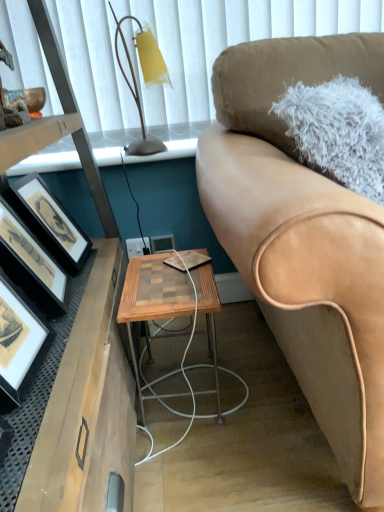
The height and width of the screenshot is (512, 384). Describe the element at coordinates (153, 298) in the screenshot. I see `woodenmaterial/texturetable at center` at that location.

Image resolution: width=384 pixels, height=512 pixels. Identify the location of matte black picture frame at left, the 2th picture frame from the back. (49, 221).

The image size is (384, 512). Find the location of `white fabric window screen at upper center`. white fabric window screen at upper center is located at coordinates (221, 50).

The image size is (384, 512). Find the location of `woodenmaterial/texturetable at center`. woodenmaterial/texturetable at center is located at coordinates (153, 298).

Does matte black picture frame at left, the 3th picture frame when ordered from back to front, have a greater height compared to wooden desk at left?

Incorrect, the height of matte black picture frame at left, the 3th picture frame when ordered from back to front, is not larger of that of wooden desk at left.

How many degrees apart are the facing directions of matte black picture frame at left, the second picture frame positioned from the left, and wooden desk at left?

7.05 degrees.

Between point (1, 232) and point (78, 117), which one is positioned behind?

Positioned behind is point (78, 117).

Is matte black picture frame at left, positioned as the second picture frame in right-to-left order, bigger or smaller than wooden desk at left?

In the image, matte black picture frame at left, positioned as the second picture frame in right-to-left order, appears to be smaller than wooden desk at left.

Can you confirm if tan leather couch at right is positioned to the right of matte black picture frame at left, positioned as the second picture frame in right-to-left order?

Indeed, tan leather couch at right is positioned on the right side of matte black picture frame at left, positioned as the second picture frame in right-to-left order.

From a real-world perspective, which is physically above, tan leather couch at right or matte black picture frame at left, positioned as the second picture frame in right-to-left order?

In real-world perspective, tan leather couch at right is above.

Considering the sizes of objects tan leather couch at right and matte black picture frame at left, the second picture frame positioned from the left, in the image provided, who is wider, tan leather couch at right or matte black picture frame at left, the second picture frame positioned from the left,?

tan leather couch at right.

Is matte black picture frame at left, the 3th picture frame when ordered from back to front, surrounded by tan leather couch at right?

That's incorrect, matte black picture frame at left, the 3th picture frame when ordered from back to front, is not inside tan leather couch at right.

Is wooden desk at left located outside wooden picture frame at center, positioned as the third picture frame in left-to-right order?

Yes, wooden desk at left is outside of wooden picture frame at center, positioned as the third picture frame in left-to-right order.

Which is in front, wooden desk at left or wooden picture frame at center, acting as the 3th picture frame starting from the front?

wooden desk at left is in front.

Which is closer to the camera, (x=38, y=17) or (x=168, y=242)?

Point (x=38, y=17).

Which of these two, wooden desk at left or wooden picture frame at center, positioned as the third picture frame in left-to-right order, is smaller?

wooden picture frame at center, positioned as the third picture frame in left-to-right order.

Does matte black picture frame at left, which is the third picture frame in right-to-left order, lie behind tan leather couch at right?

Yes, it is.

From the picture: Between matte black picture frame at left, which is the third picture frame in right-to-left order, and tan leather couch at right, which one appears on the right side from the viewer's perspective?

tan leather couch at right is more to the right.

Could you tell me if matte black picture frame at left, which is the third picture frame in right-to-left order, is facing tan leather couch at right?

Yes, matte black picture frame at left, which is the third picture frame in right-to-left order, is oriented towards tan leather couch at right.

Is tan leather couch at right completely or partially inside matte black picture frame at left, which is the third picture frame in right-to-left order?

No, tan leather couch at right is not surrounded by matte black picture frame at left, which is the third picture frame in right-to-left order.

Which object is further away from the camera taking this photo, matte yellow glass at upper left or matte black picture frame at left, placed as the first picture frame when sorted from front to back?

matte yellow glass at upper left is further away from the camera.

Are matte yellow glass at upper left and matte black picture frame at left, positioned as the second picture frame in right-to-left order, far apart?

Actually, matte yellow glass at upper left and matte black picture frame at left, positioned as the second picture frame in right-to-left order, are a little close together.

Would you say matte yellow glass at upper left is inside or outside matte black picture frame at left, positioned as the second picture frame in right-to-left order?

matte yellow glass at upper left exists outside the volume of matte black picture frame at left, positioned as the second picture frame in right-to-left order.

Considering the relative sizes of matte yellow glass at upper left and matte black picture frame at left, positioned as the second picture frame in right-to-left order, in the image provided, is matte yellow glass at upper left shorter than matte black picture frame at left, positioned as the second picture frame in right-to-left order,?

In fact, matte yellow glass at upper left may be taller than matte black picture frame at left, positioned as the second picture frame in right-to-left order.

Between matte yellow glass at upper left and white fabric window screen at upper center, which one appears on the right side from the viewer's perspective?

From the viewer's perspective, white fabric window screen at upper center appears more on the right side.

From a real-world perspective, relative to white fabric window screen at upper center, is matte yellow glass at upper left vertically above or below?

In terms of real-world spatial position, matte yellow glass at upper left is below white fabric window screen at upper center.

Which of these two, matte yellow glass at upper left or white fabric window screen at upper center, stands shorter?

matte yellow glass at upper left is shorter.

Which is closer, [111,11] or [108,22]?

Point [111,11]

Which is behind, point (7, 214) or point (63, 229)?

Point (63, 229)

Considering the sizes of objects matte black picture frame at left, the 3th picture frame when ordered from back to front, and matte black picture frame at left, the 2th picture frame from the back, in the image provided, who is thinner, matte black picture frame at left, the 3th picture frame when ordered from back to front, or matte black picture frame at left, the 2th picture frame from the back,?

matte black picture frame at left, the 3th picture frame when ordered from back to front, is thinner.

In the scene shown: Can you confirm if matte black picture frame at left, placed as the first picture frame when sorted from front to back, is taller than matte black picture frame at left, which ranks as the 2th picture frame in front-to-back order?

Incorrect, the height of matte black picture frame at left, placed as the first picture frame when sorted from front to back, is not larger of that of matte black picture frame at left, which ranks as the 2th picture frame in front-to-back order.

Is matte black picture frame at left, which ranks as the 2th picture frame in front-to-back order, inside matte black picture frame at left, placed as the first picture frame when sorted from front to back?

No, matte black picture frame at left, which ranks as the 2th picture frame in front-to-back order, is not a part of matte black picture frame at left, placed as the first picture frame when sorted from front to back.

You are a GUI agent. You are given a task and a screenshot of the screen. Output one action in this format:
    pyautogui.click(x=<x>, y=<y>)
    Task: Click on the picture frame that is the 1st one below the wooden desk at left (from a real-world perspective)
    The image size is (384, 512).
    Given the screenshot: What is the action you would take?
    pyautogui.click(x=31, y=264)

The width and height of the screenshot is (384, 512). In order to click on the 2nd picture frame to the left of the tan leather couch at right, counting from the anchor's position in this screenshot , I will do click(x=31, y=264).

Considering their positions, is white fabric window screen at upper center positioned further to tan leather couch at right than matte yellow glass at upper left?

matte yellow glass at upper left is positioned further to the anchor tan leather couch at right.

Which object lies nearer to the anchor point matte black picture frame at left, the 2th picture frame from the back, wooden picture frame at center, which appears as the 1th picture frame when viewed from the right, or wooden desk at left?

wooden desk at left.

Looking at the image, which one is located closer to woodenmaterial/texturetable at center, matte black picture frame at left, placed as the first picture frame when sorted from front to back, or matte yellow glass at upper left?

The object closer to woodenmaterial/texturetable at center is matte black picture frame at left, placed as the first picture frame when sorted from front to back.

From the image, which object appears to be nearer to matte black picture frame at left, the second picture frame positioned from the left, matte yellow glass at upper left or white fabric window screen at upper center?

Among the two, white fabric window screen at upper center is located nearer to matte black picture frame at left, the second picture frame positioned from the left.

Which object lies further to the anchor point matte black picture frame at left, which ranks as the 2th picture frame in front-to-back order, tan leather couch at right or wooden picture frame at center, positioned as the third picture frame in left-to-right order?

tan leather couch at right.

From the image, which object appears to be nearer to matte yellow glass at upper left, tan leather couch at right or white fabric window screen at upper center?

white fabric window screen at upper center lies closer to matte yellow glass at upper left than the other object.

Based on their spatial positions, is matte yellow glass at upper left or wooden desk at left closer to woodenmaterial/texturetable at center?

wooden desk at left.

Estimate the real-world distances between objects in this image. Which object is closer to matte yellow glass at upper left, woodenmaterial/texturetable at center or white fabric window screen at upper center?

white fabric window screen at upper center is closer to matte yellow glass at upper left.

Identify the location of table lamp between white fabric window screen at upper center and woodenmaterial/texturetable at center in the up-down direction. (144, 79).

The width and height of the screenshot is (384, 512). In order to click on table lamp between tan leather couch at right and white fabric window screen at upper center from front to back in this screenshot , I will do `click(144, 79)`.

The image size is (384, 512). Find the location of `desk between matte black picture frame at left, positioned as the second picture frame in right-to-left order, and tan leather couch at right`. desk between matte black picture frame at left, positioned as the second picture frame in right-to-left order, and tan leather couch at right is located at coordinates 86,350.

At what (x,y) coordinates should I click in order to perform the action: click on table lamp between white fabric window screen at upper center and matte black picture frame at left, placed as the first picture frame when sorted from front to back, in the vertical direction. Please return your answer as a coordinate pair (x, y). The image size is (384, 512). Looking at the image, I should click on (144, 79).